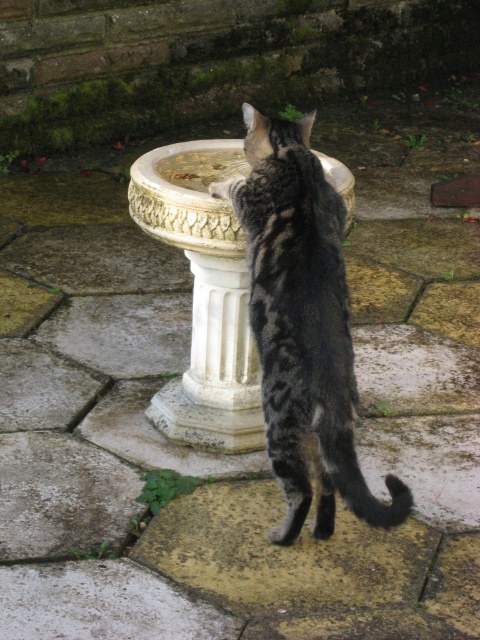
Based on the photo, where is the tabby fur cat at center located in the image?

The tabby fur cat at center is located at point coordinates of (302, 326).

You are standing at the camera position and want to throw a small treat to the tabby fur cat at center. If the treat can travel 8 feet, will it reach the cat?

The tabby fur cat at center and camera are 8.18 feet apart. Since the treat can only travel 8 feet, it will not reach the cat.

You are a gardener who needs to place a new flower pot between the tabby fur cat at center and the white marble pillar at center. Based on their positions, where should you place the flower pot?

The tabby fur cat at center is positioned under the white marble pillar at center, so you should place the flower pot between them at the base of the pillar where the cat is located.